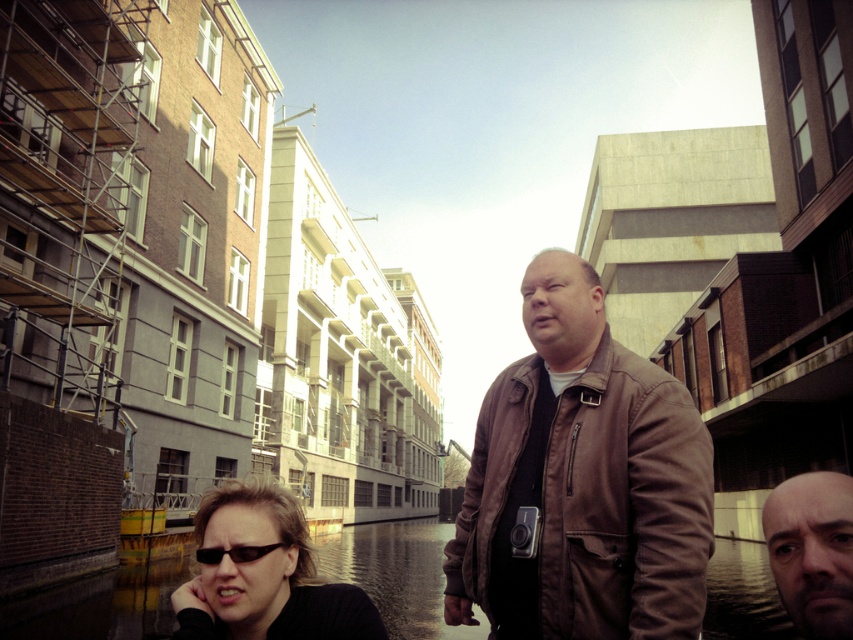
Question: Is brown leather jacket at center to the right of bald head at center from the viewer's perspective?

Choices:
 (A) yes
 (B) no

Answer: (B)

Question: Does black matte sunglasses at lower left have a greater width compared to black plastic sunglasses at lower left?

Choices:
 (A) no
 (B) yes

Answer: (B)

Question: Which object is positioned closest to the black matte sunglasses at lower left?

Choices:
 (A) bald head at center
 (B) brown leather jacket at center
 (C) black plastic sunglasses at lower left

Answer: (C)

Question: Considering the real-world distances, which object is closest to the bald head at center?

Choices:
 (A) brown leather jacket at center
 (B) black plastic sunglasses at lower left

Answer: (A)

Question: Estimate the real-world distances between objects in this image. Which object is closer to the black matte sunglasses at lower left?

Choices:
 (A) bald head at center
 (B) black plastic sunglasses at lower left
 (C) brown leather jacket at center

Answer: (B)

Question: Is brown leather jacket at center below black matte sunglasses at lower left?

Choices:
 (A) no
 (B) yes

Answer: (A)